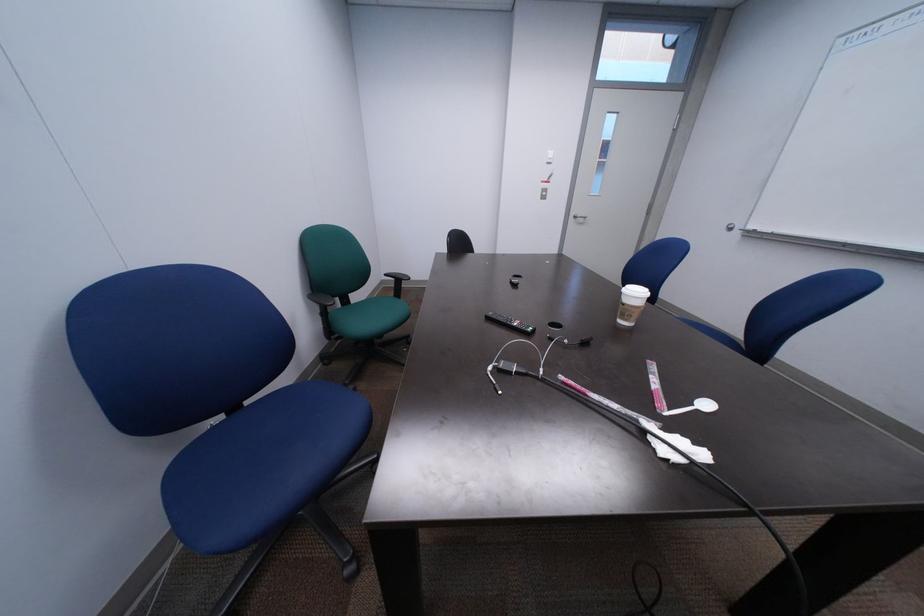
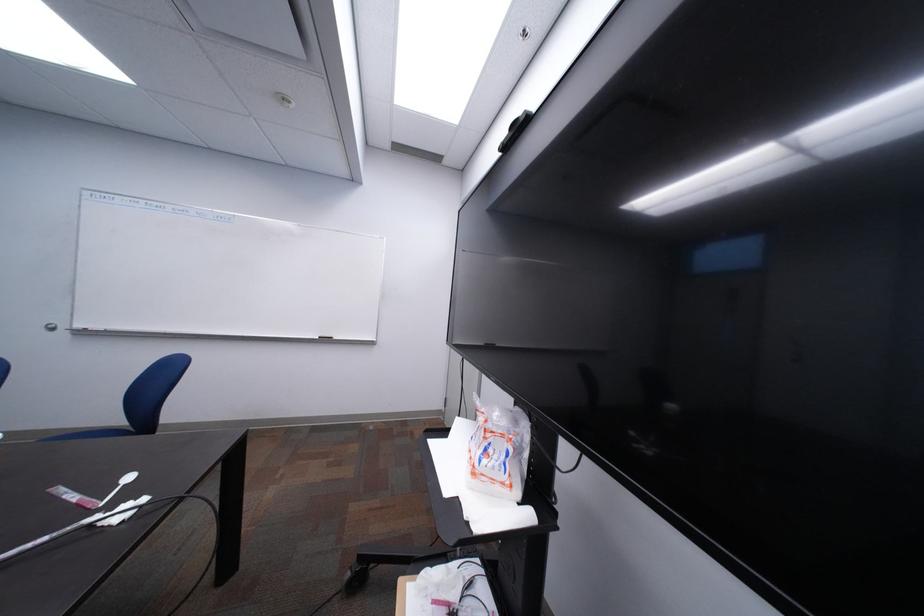
Question: The camera is either moving clockwise (left) or counter-clockwise (right) around the object. The first image is from the beginning of the video and the second image is from the end. Is the camera moving left or right when shooting the video?

Choices:
 (A) Left
 (B) Right

Answer: (A)